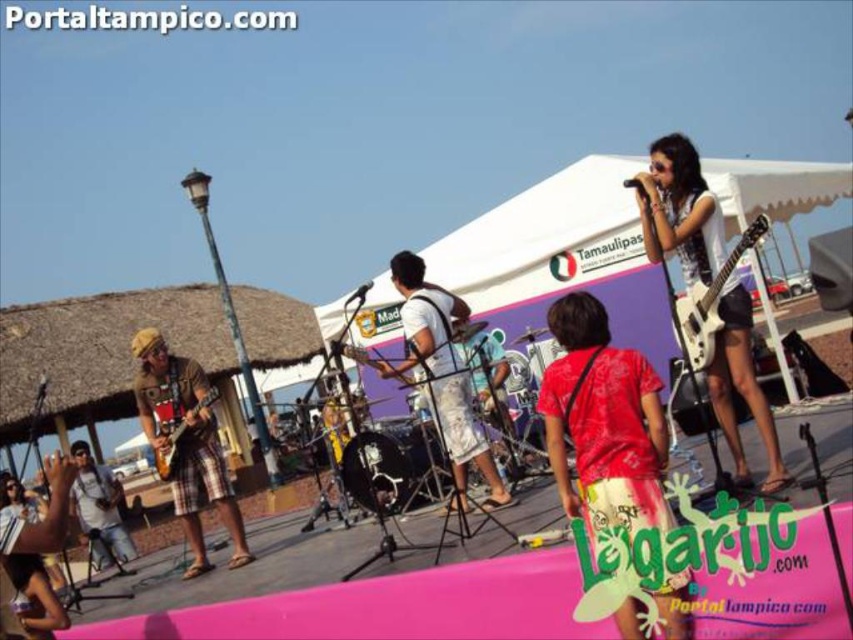
Question: Which of the following is the farthest from the observer?

Choices:
 (A) white glossy electric guitar at upper right
 (B) matte brown guitar at lower left

Answer: (B)

Question: Estimate the real-world distances between objects in this image. Which object is farther from the white glossy electric guitar at upper right?

Choices:
 (A) denim shorts at center
 (B) matte brown guitar at left

Answer: (A)

Question: Where is brown plaid shorts at left located in relation to matte brown guitar at lower left in the image?

Choices:
 (A) right
 (B) left

Answer: (A)

Question: Which object appears closest to the camera in this image?

Choices:
 (A) white glossy electric guitar at upper right
 (B) red cotton shirt at center
 (C) matte white guitar at center
 (D) matte brown guitar at lower left

Answer: (B)

Question: Does white glossy electric guitar at upper right lie in front of matte black electric guitar at center?

Choices:
 (A) yes
 (B) no

Answer: (A)

Question: Can you confirm if white glossy guitar at center is positioned to the right of white glossy electric guitar at upper right?

Choices:
 (A) yes
 (B) no

Answer: (A)